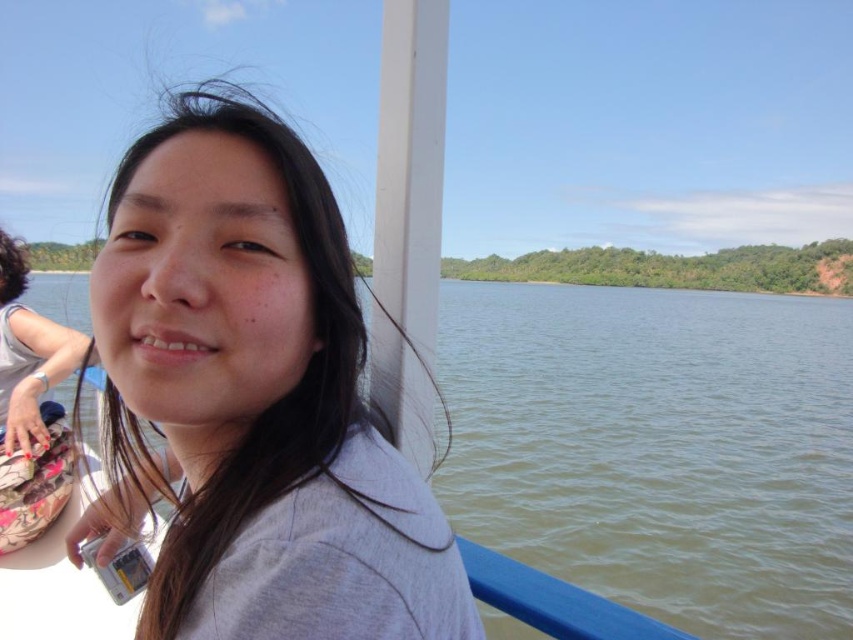
You are a photographer on a boat and want to capture the reflection of the green water at center in your shot. However, the gray matte shirt at upper left is blocking part of the reflection. To fix this, should you move your camera upwards or downwards?

The gray matte shirt at upper left is positioned under green water at center. To avoid blocking the reflection, you should move your camera upwards so that the shirt is no longer in front of the green water at center.

You are a photographer on a boat and want to capture both the point at coordinates [125,172] and the point at coordinates [596,488] in your shot. Which point will appear closer to the edge of your camera frame?

Point at coordinates [125,172] will appear closer to the edge of your camera frame because it is closer to the camera than point at coordinates [596,488].